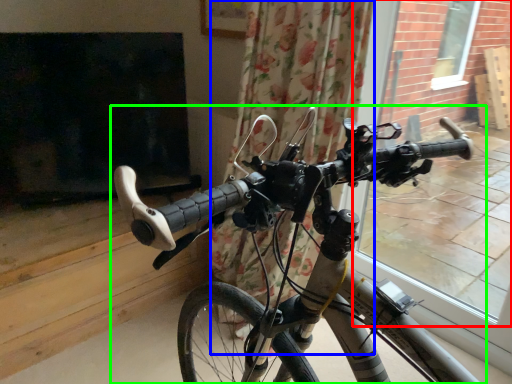
Question: Considering the real-world distances, which object is farthest from window frame (highlighted by a red box)? curtain (highlighted by a blue box) or bicycle (highlighted by a green box)?

Choices:
 (A) curtain
 (B) bicycle

Answer: (B)